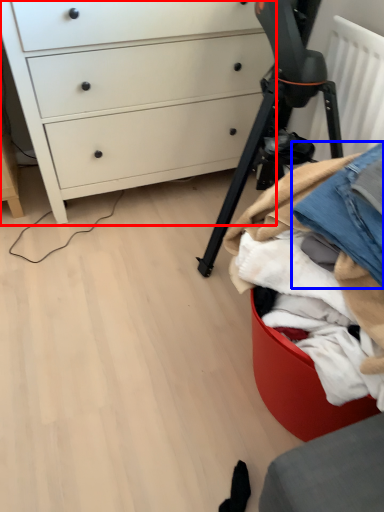
Question: Among these objects, which one is farthest to the camera, chest of drawers (highlighted by a red box) or jeans (highlighted by a blue box)?

Choices:
 (A) chest of drawers
 (B) jeans

Answer: (A)